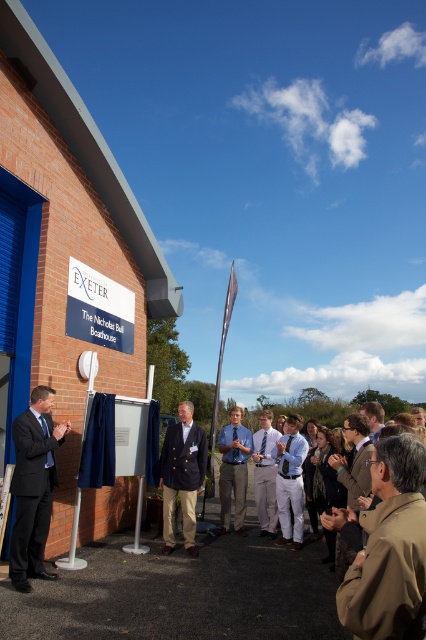
Can you confirm if brown leather jacket at lower right is bigger than navy blue blazer at center?

Incorrect, brown leather jacket at lower right is not larger than navy blue blazer at center.

Based on the photo, which is below, brown leather jacket at lower right or navy blue blazer at center?

navy blue blazer at center is lower down.

Is point (400, 605) more distant than point (204, 467)?

No.

This screenshot has height=640, width=426. What are the coordinates of `brown leather jacket at lower right` in the screenshot? It's located at (389, 548).

Who is more forward, (48, 390) or (365, 416)?

Point (365, 416)

Does matte black suit at left appear on the left side of light brown leather jacket at center?

Correct, you'll find matte black suit at left to the left of light brown leather jacket at center.

Where is `matte black suit at left`? This screenshot has width=426, height=640. matte black suit at left is located at coordinates (34, 486).

The height and width of the screenshot is (640, 426). I want to click on matte black suit at left, so click(34, 486).

You are a GUI agent. You are given a task and a screenshot of the screen. Output one action in this format:
    pyautogui.click(x=<x>, y=<y>)
    Task: Click on the brown leather jacket at lower right
    
    Given the screenshot: What is the action you would take?
    pyautogui.click(x=389, y=548)

Looking at this image, is brown leather jacket at lower right positioned in front of matte black suit at left?

Yes.

What are the coordinates of `brown leather jacket at lower right` in the screenshot? It's located at (389, 548).